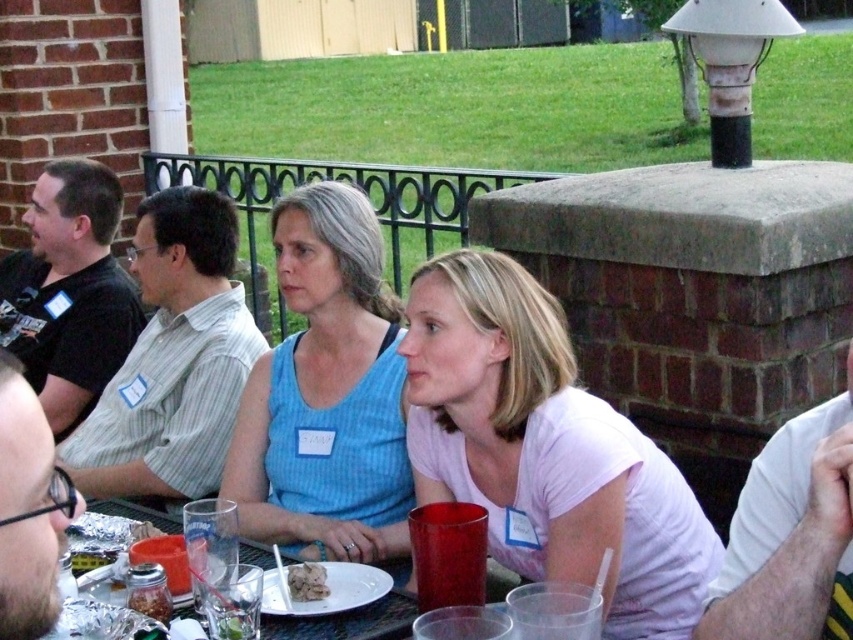
You are a photographer trying to capture a closeup of the clear plastic plate at lower center without the blue striped tank top at center blocking the view. Is the plate visible from your current position?

The blue striped tank top at center is taller than clear plastic plate at lower center, so it might block the view of the plate. Move closer to the plate to ensure the tank top doesn not obstruct it.

You are organizing a picnic and need to place items on the table. Given the blue striped tank top at center and the clear plastic plate at lower center, which item takes up more space on the table?

The blue striped tank top at center is larger in size than the clear plastic plate at lower center, so it takes up more space on the table.

Consider the image. You are standing at the edge of the gathering area and want to hand a drink to the person wearing the blue striped tank top at center. If you can reach 2 meters, will you be able to hand it without moving closer?

The blue striped tank top at center and viewer are 2.65 meters apart from each other. Since your reach is only 2 meters, you cannot hand the drink without moving closer.